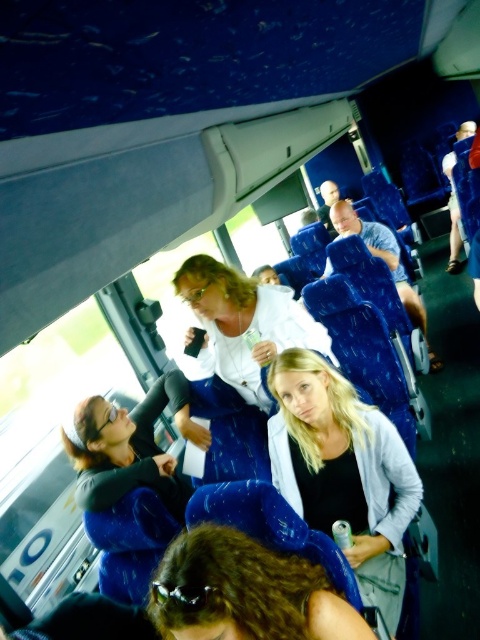
Who is positioned more to the right, shiny brown hair at lower center or white matte jacket at center?

shiny brown hair at lower center

Is point (324, 605) more distant than point (225, 308)?

No, (324, 605) is closer to viewer.

Find the location of `shiny brown hair at lower center`. shiny brown hair at lower center is located at coordinates (245, 592).

Is matte black jacket at center above white matte jacket at center?

No, matte black jacket at center is not above white matte jacket at center.

Identify the location of matte black jacket at center. The image size is (480, 640). (132, 449).

Does shiny brown hair at lower center appear on the right side of matte black jacket at center?

Indeed, shiny brown hair at lower center is positioned on the right side of matte black jacket at center.

Can you confirm if shiny brown hair at lower center is positioned below matte black jacket at center?

No.

What do you see at coordinates (245, 592) in the screenshot?
I see `shiny brown hair at lower center` at bounding box center [245, 592].

Where is `shiny brown hair at lower center`? shiny brown hair at lower center is located at coordinates (245, 592).